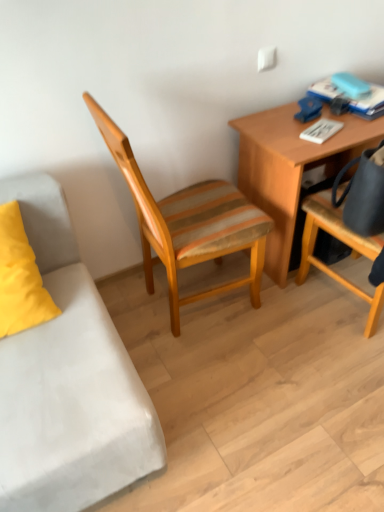
This screenshot has width=384, height=512. Find the location of `vacant space to the left of matte black bag at right, the 1th chair positioned from the right`. vacant space to the left of matte black bag at right, the 1th chair positioned from the right is located at coordinates (286, 337).